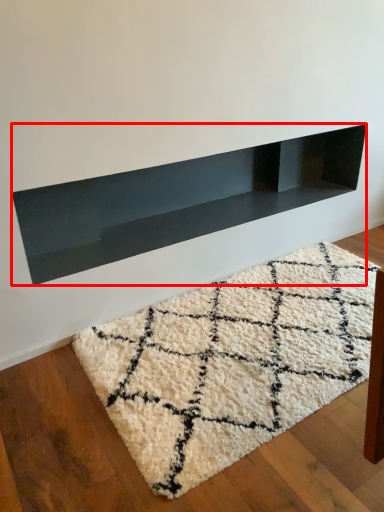
Question: From the image's perspective, what is the correct spatial positioning of shelf (annotated by the red box) in reference to mat?

Choices:
 (A) below
 (B) above

Answer: (B)